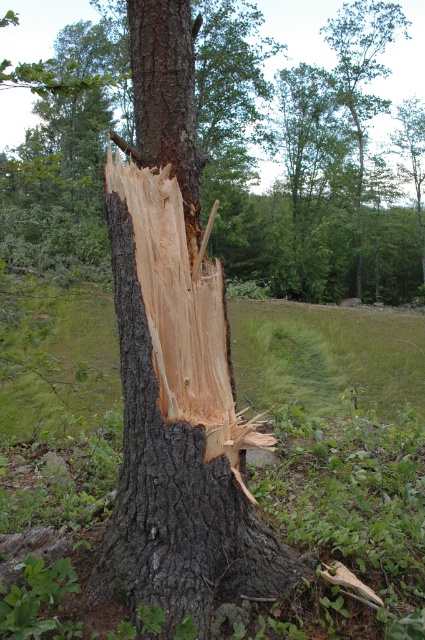
Question: Is smooth brown bark at center positioned before dark brown rough bark at center?

Choices:
 (A) no
 (B) yes

Answer: (A)

Question: Considering the relative positions of smooth brown bark at center and dark brown rough bark at center in the image provided, where is smooth brown bark at center located with respect to dark brown rough bark at center?

Choices:
 (A) below
 (B) above

Answer: (B)

Question: In this image, where is smooth brown bark at center located relative to dark brown rough bark at center?

Choices:
 (A) left
 (B) right

Answer: (A)